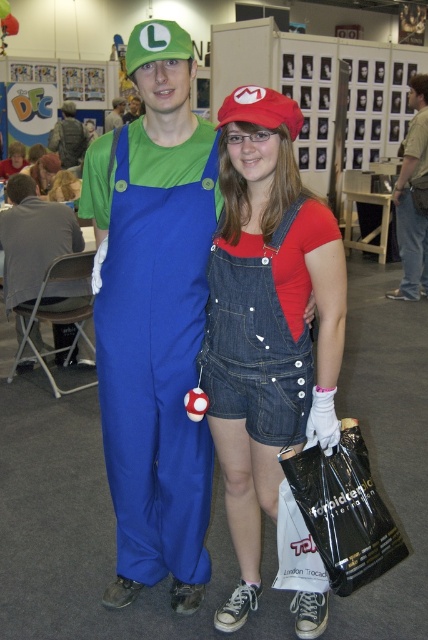
You are a photographer at a Mario themed event and need to capture a photo of the denim overalls at center and the brushed metal water at bottle left. Based on their positions, which object is located below the other?

The denim overalls at center is positioned under the brushed metal water at bottle left, so the denim overalls at center is below the brushed metal water at bottle left.

You are standing at the position of point (131, 108) and want to walk to the exit located at point (300, 193). Based on the scene description, will you need to move forward or backward to reach the exit?

Since point (300, 193) is in front of point (131, 108), you will need to move forward to reach the exit located at point (300, 193).

You are a photographer at a Mario themed event. You need to take a photo of the blue cotton overalls at center and the matte green fabric luigi hat at upper center. The camera you are using has a maximum focus range of 7 meters. Will you be able to capture both items clearly in focus?

The blue cotton overalls at center and the matte green fabric luigi hat at upper center are 7.39 meters apart from each other. Since the camera has a maximum focus range of 7 meters, the distance between them exceeds this limit. Therefore, you won